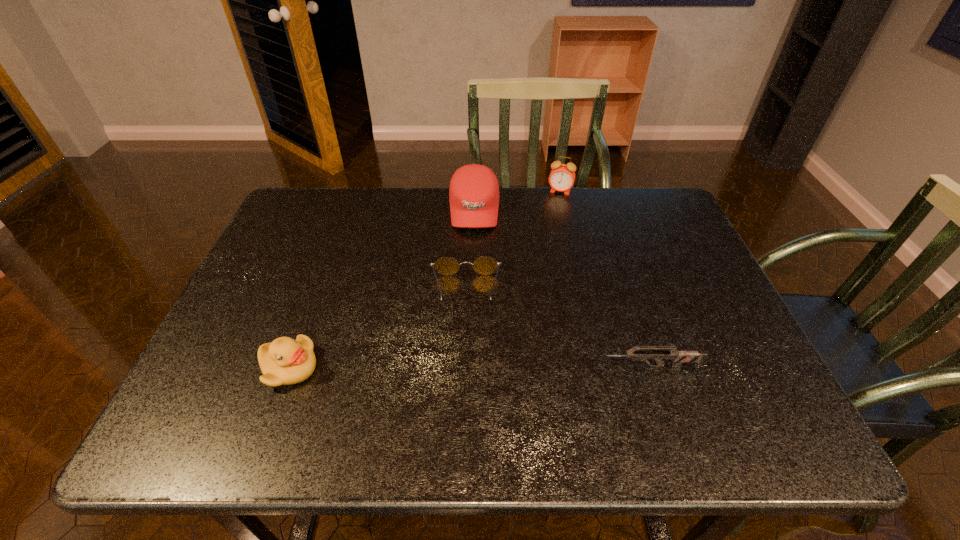
Find the location of `the leftmost object`. the leftmost object is located at coordinates (285, 361).

Identify the location of the third shortest object. (285, 361).

Image resolution: width=960 pixels, height=540 pixels. I want to click on gun, so 679,357.

Find the location of a particular element. the third nearest object is located at coordinates (484, 265).

Locate an element on the screen. cap is located at coordinates (474, 191).

This screenshot has height=540, width=960. Identify the location of alarm clock. (562, 177).

The width and height of the screenshot is (960, 540). I want to click on vacant space located on the front-facing side of the leftmost object, so click(496, 368).

You are a GUI agent. You are given a task and a screenshot of the screen. Output one action in this format:
    pyautogui.click(x=<x>, y=<y>)
    Task: Click on the free spot located aimed along the barrel of the gun
    
    Given the screenshot: What is the action you would take?
    pyautogui.click(x=551, y=367)

Image resolution: width=960 pixels, height=540 pixels. In order to click on vacant space positioned 0.390m aimed along the barrel of the gun in this screenshot , I will do `click(415, 367)`.

Image resolution: width=960 pixels, height=540 pixels. I want to click on vacant space located 0.330m aimed along the barrel of the gun, so click(x=443, y=367).